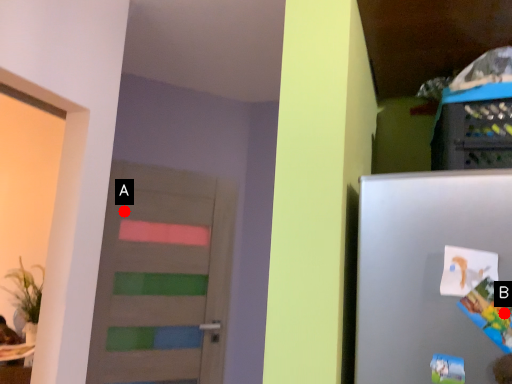
Question: Two points are circled on the image, labeled by A and B beside each circle. Which of the following is the closest to the observer?

Choices:
 (A) A is closer
 (B) B is closer

Answer: (B)